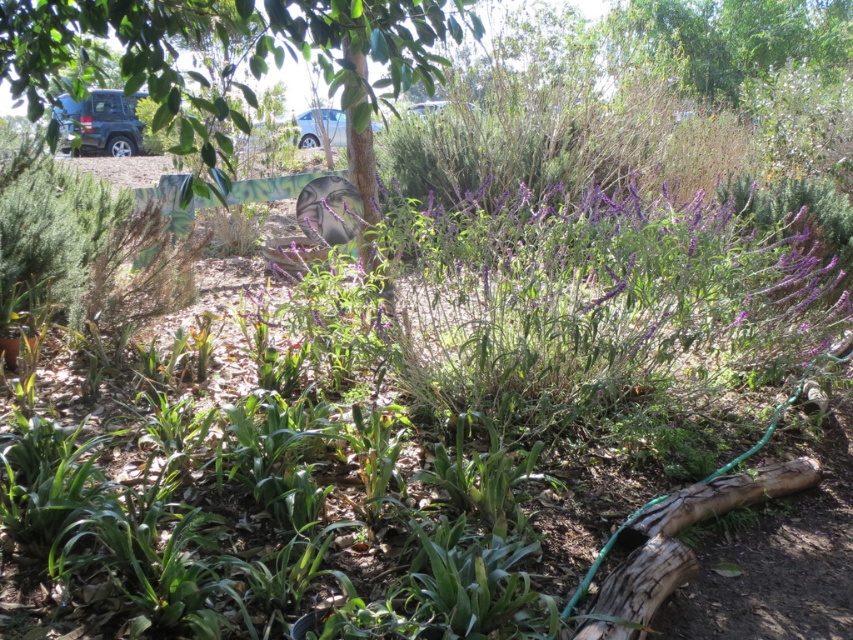
You are a gardener who needs to place a 6.5 feet long wooden bench between the green leafy tree at center and the curved, painted wooden bench in the middle ground. Is there enough space between them to fit the bench?

The distance between the green leafy tree at center and the curved, painted wooden bench in the middle ground is 6.59 feet. Since the bench is 6.5 feet long, there is just enough space to fit it between them with a small gap remaining.

You are a gardener planning to water the green leafy tree at center and the green leafy plant at lower left. Which of the two plants is positioned higher in the image?

The green leafy tree at center is located above the green leafy plant at lower left, so it is positioned higher in the image.

In the garden scene, you see a green leafy tree at center and a green leafy plant at lower left. From the perspective of someone standing in front of the garden, which object is positioned to the right of the other?

The green leafy tree at center is positioned to the right of the green leafy plant at lower left.